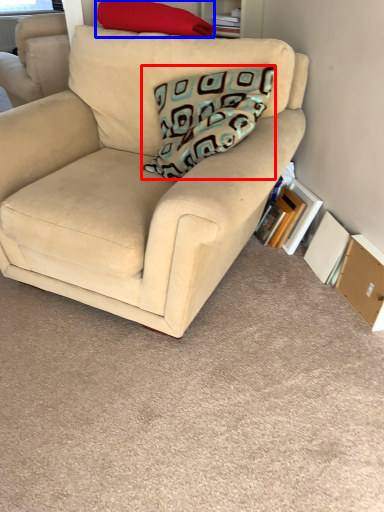
Question: Which of the following is the farthest to the observer, pillow (highlighted by a red box) or pillow (highlighted by a blue box)?

Choices:
 (A) pillow
 (B) pillow

Answer: (B)